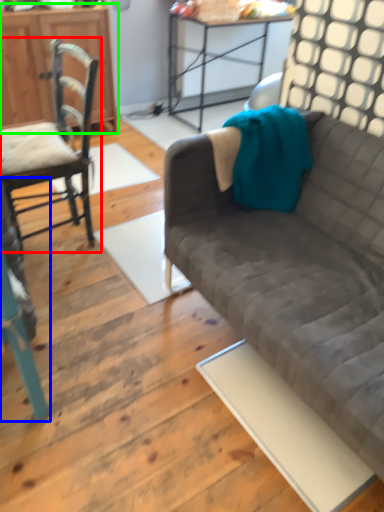
Question: Based on their relative distances, which object is nearer to chair (highlighted by a red box)? Choose from chair (highlighted by a blue box) and cabinetry (highlighted by a green box).

Choices:
 (A) chair
 (B) cabinetry

Answer: (A)